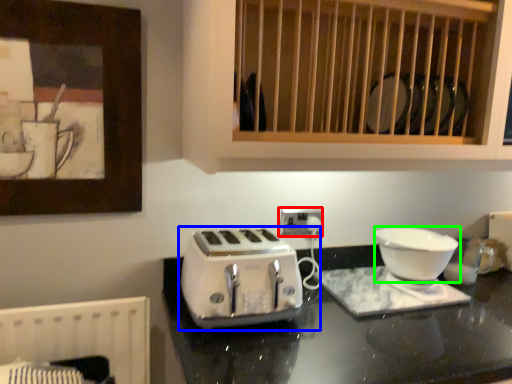
Question: Which object is the closest to the electric outlet (highlighted by a red box)? Choose among these: toaster (highlighted by a blue box) or kitchen appliance (highlighted by a green box).

Choices:
 (A) toaster
 (B) kitchen appliance

Answer: (A)